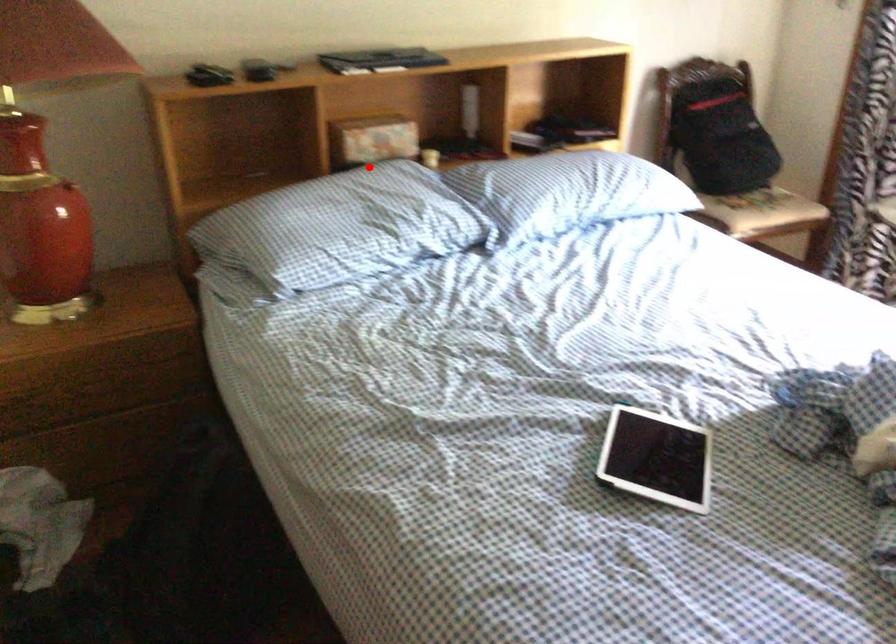
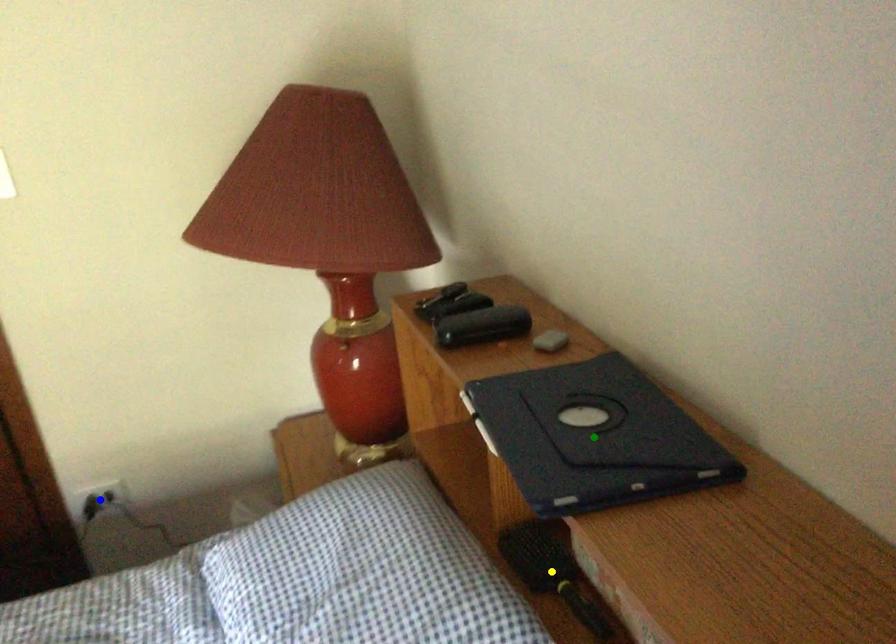
Question: I am providing you with two images of the same scene from different viewpoints. A red point is marked on the first image. You are given multiple points on the second image. In image 2, which mark is for the same physical point as the one in image 1?

Choices:
 (A) green point
 (B) blue point
 (C) yellow point

Answer: (C)